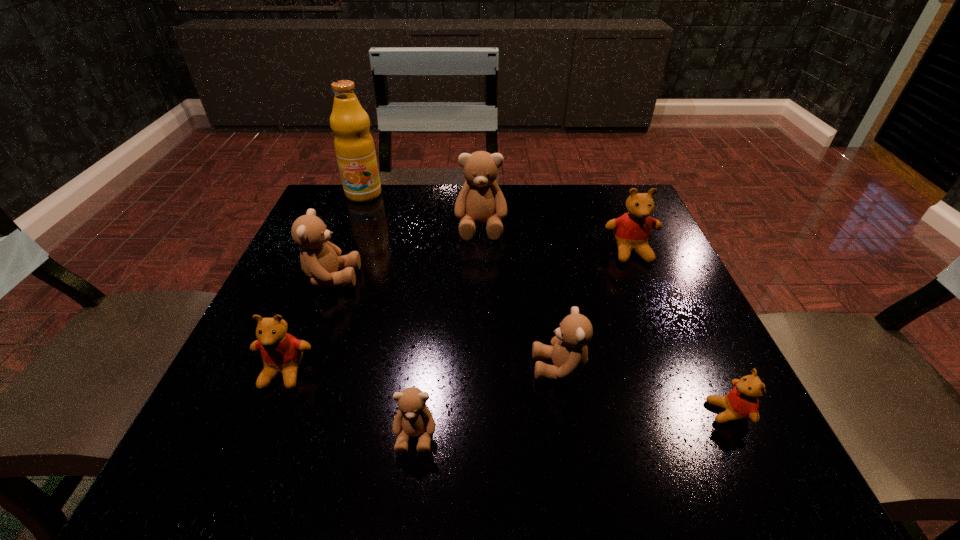
Locate an element on the screen. This screenshot has width=960, height=540. the smallest red teddy bear is located at coordinates (741, 403).

Find the location of a particular element. This screenshot has width=960, height=540. the fourth object from left to right is located at coordinates (413, 418).

Locate an element on the screen. The width and height of the screenshot is (960, 540). the fifth teddy bear from right to left is located at coordinates (413, 418).

Identify the location of vacant space situated 0.250m on the front label of the farthest object. Image resolution: width=960 pixels, height=540 pixels. (336, 264).

This screenshot has height=540, width=960. I want to click on vacant space situated on the front-facing side of the second tallest object, so click(481, 379).

The width and height of the screenshot is (960, 540). Identify the location of free space located 0.130m on the front-facing side of the third nearest brown teddy bear. (420, 278).

This screenshot has width=960, height=540. Identify the location of vacant point located 0.400m on the front-facing side of the biggest red teddy bear. (708, 437).

You are a GUI agent. You are given a task and a screenshot of the screen. Output one action in this format:
    pyautogui.click(x=<x>, y=<y>)
    Task: Click on the free space located 0.080m on the front-facing side of the third farthest brown teddy bear
    The width and height of the screenshot is (960, 540).
    Given the screenshot: What is the action you would take?
    pyautogui.click(x=486, y=368)

Locate an element on the screen. The width and height of the screenshot is (960, 540). free space located 0.310m on the front-facing side of the third farthest brown teddy bear is located at coordinates (350, 368).

Identify the location of free point located 0.230m on the front-facing side of the third farthest brown teddy bear. The image size is (960, 540). (397, 368).